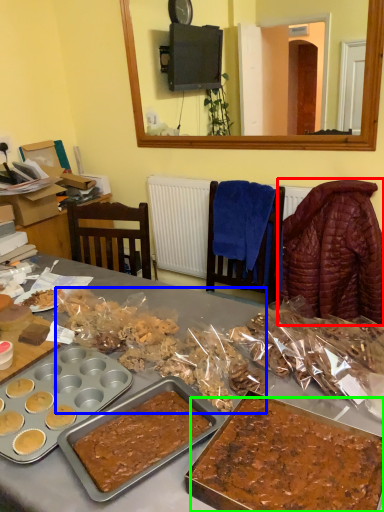
Question: Estimate the real-world distances between objects in this image. Which object is farther from blanket (highlighted by a red box), snack (highlighted by a blue box) or dessert (highlighted by a green box)?

Choices:
 (A) snack
 (B) dessert

Answer: (B)